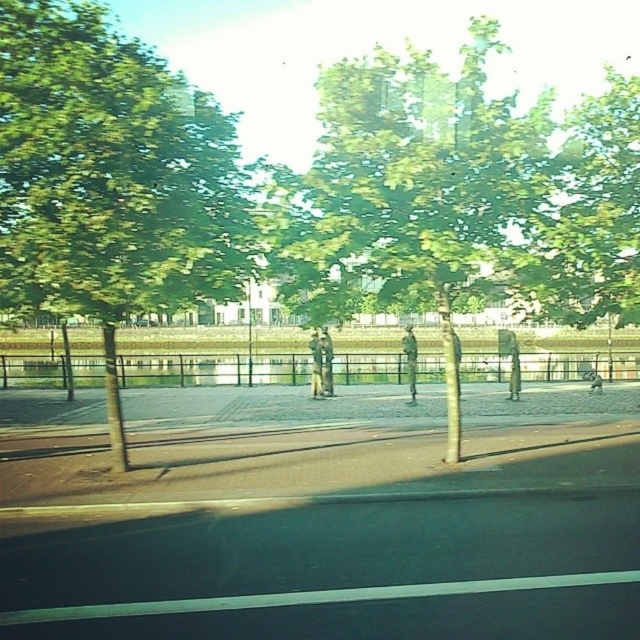
Question: Which object is the closest to the green leafy tree at center?

Choices:
 (A) green leafy tree at upper left
 (B) matte gray statue at center
 (C) metallic silver jacket at center

Answer: (A)

Question: Which object is closer to the camera taking this photo?

Choices:
 (A) green metallic statue at center
 (B) green leafy tree at center
 (C) matte gray statue at center

Answer: (B)

Question: Is green leafy tree at upper left above matte gray statue at center?

Choices:
 (A) yes
 (B) no

Answer: (A)

Question: Considering the relative positions of metallic silver jacket at center and green metallic statue at center in the image provided, where is metallic silver jacket at center located with respect to green metallic statue at center?

Choices:
 (A) above
 (B) below

Answer: (A)

Question: Is the position of green leafy tree at upper left more distant than that of matte gray statue at center?

Choices:
 (A) yes
 (B) no

Answer: (B)

Question: Among these objects, which one is nearest to the camera?

Choices:
 (A) green metallic statue at center
 (B) green leafy tree at center
 (C) metallic silver jacket at center

Answer: (B)